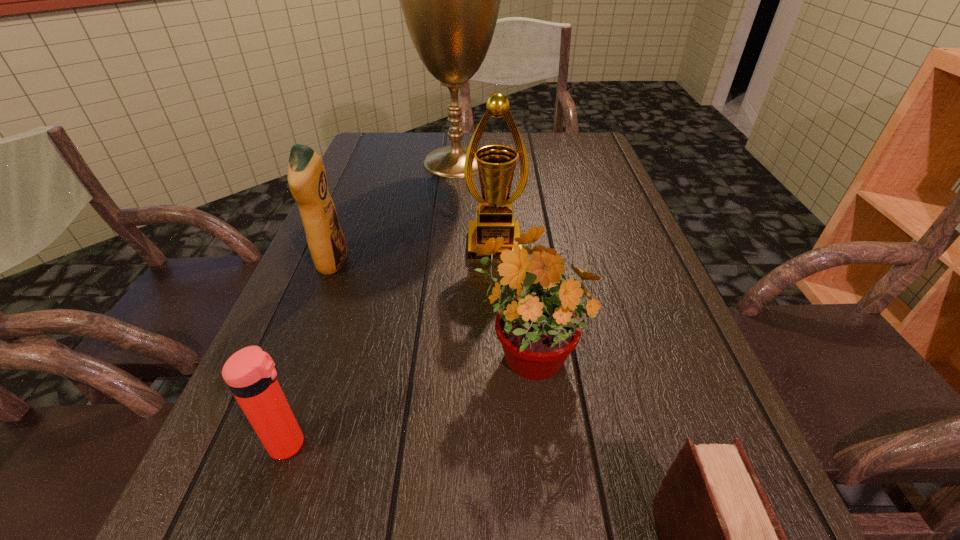
This screenshot has width=960, height=540. In order to click on the farthest object in this screenshot , I will do `click(450, 0)`.

The image size is (960, 540). Identify the location of the tallest object. (450, 0).

Locate an element on the screen. The width and height of the screenshot is (960, 540). award is located at coordinates (496, 163).

What are the coordinates of `detergent` in the screenshot? It's located at (307, 180).

The width and height of the screenshot is (960, 540). In order to click on the fourth farthest object in this screenshot , I will do pyautogui.click(x=538, y=329).

Where is `thermos bottle`? This screenshot has height=540, width=960. thermos bottle is located at coordinates (250, 373).

The height and width of the screenshot is (540, 960). I want to click on the second nearest object, so click(x=250, y=373).

Locate an element on the screen. Image resolution: width=960 pixels, height=540 pixels. vacant space positioned 0.110m on the right of the farthest object is located at coordinates (535, 161).

The image size is (960, 540). What are the coordinates of `vacant space located 0.100m on the front-facing side of the fifth shortest object` in the screenshot? It's located at (496, 291).

Identify the location of free space located 0.260m on the label of the detergent. (463, 263).